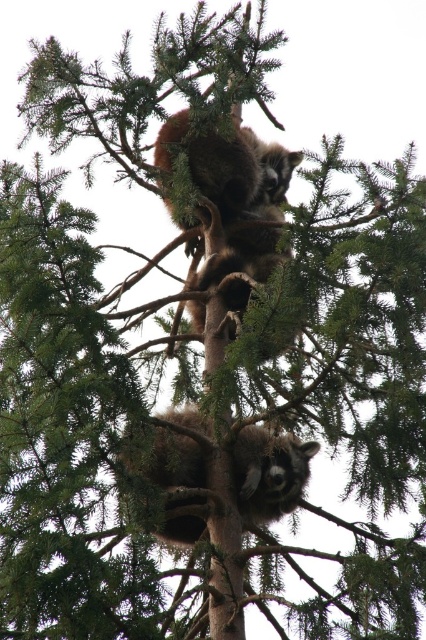
Can you confirm if fuzzy brown raccoon at upper center is shorter than fuzzy brown raccoon at center?

No, fuzzy brown raccoon at upper center is not shorter than fuzzy brown raccoon at center.

Is point (276, 227) farther from camera compared to point (190, 445)?

That is True.

Is point (258, 248) closer to camera compared to point (175, 538)?

No, (258, 248) is further to viewer.

Where is `fuzzy brown raccoon at upper center`? fuzzy brown raccoon at upper center is located at coordinates (241, 202).